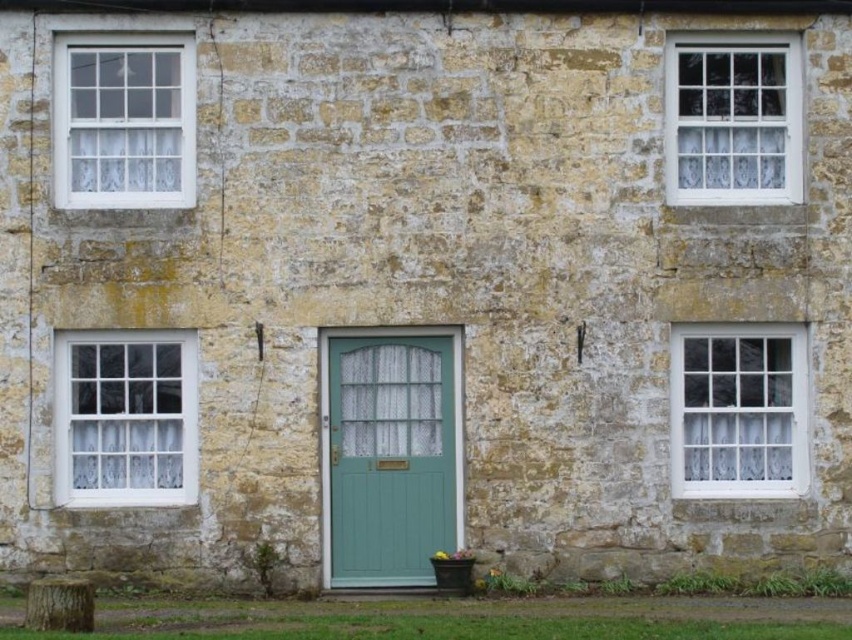
You are standing in front of the traditional stone building and want to take a photo. You notice two points marked on the building facade. The first point is at coordinate point (153, 404) and the second is at point (730, 468). If you want to focus on the point that is closer to you, which coordinate should you aim your camera at?

You should aim your camera at point (153, 404) because it is closer to the camera than point (730, 468).

You are standing 50 feet away from the building. Can you clearly see the white lace curtain at lower left from your current position?

The white lace curtain at lower left is 52.94 feet away from the viewer, so you are 2.94 feet too far to clearly see it.

You are standing in front of the traditional stone building and want to check the windows. Which window is closer to you, the white glass window at upper left or the white textured glass window at upper right?

The white glass window at upper left is closer to you because it is in front of the white textured glass window at upper right.